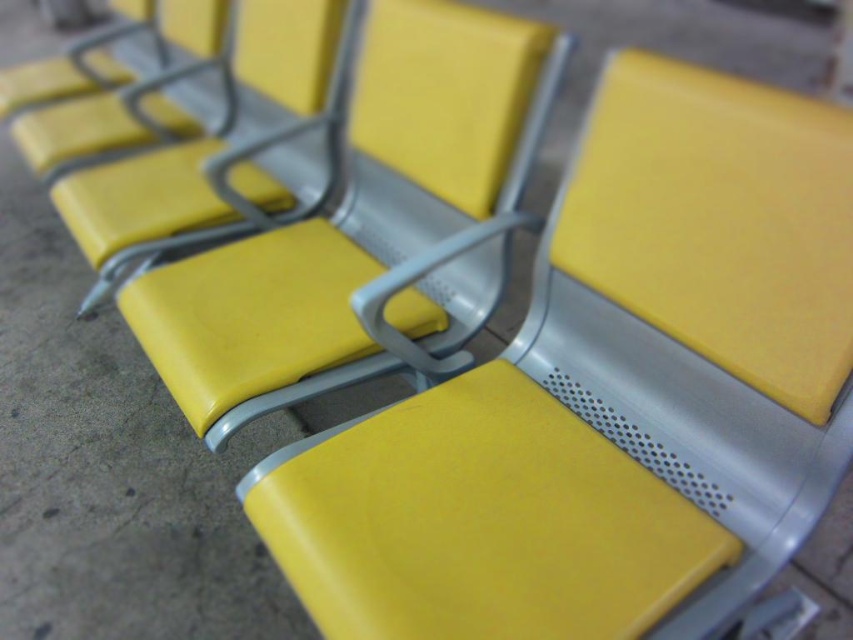
Question: Is yellow matte seat at center further to camera compared to matte yellow seat at center?

Choices:
 (A) no
 (B) yes

Answer: (A)

Question: Which of the following is the farthest from the observer?

Choices:
 (A) matte yellow seat at upper left
 (B) yellow leather chair at center

Answer: (A)

Question: Is yellow matte seat at center to the left of matte yellow seat at upper left from the viewer's perspective?

Choices:
 (A) no
 (B) yes

Answer: (A)

Question: Which object is farther from the camera taking this photo?

Choices:
 (A) yellow matte seat at center
 (B) yellow leather chair at center
 (C) matte yellow seat at center
 (D) matte yellow seat at upper left

Answer: (D)

Question: Considering the real-world distances, which object is farthest from the matte yellow seat at upper left?

Choices:
 (A) yellow matte seat at center
 (B) matte yellow seat at center
 (C) yellow leather chair at center

Answer: (A)

Question: Is matte yellow seat at center below matte yellow seat at upper left?

Choices:
 (A) no
 (B) yes

Answer: (B)